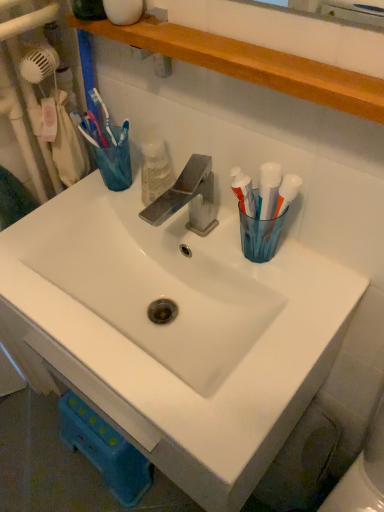
Question: Considering the positions of wooden shelf at upper center and white ceramic sink at center in the image, is wooden shelf at upper center wider or thinner than white ceramic sink at center?

Choices:
 (A) thin
 (B) wide

Answer: (A)

Question: Is wooden shelf at upper center bigger or smaller than white ceramic sink at center?

Choices:
 (A) big
 (B) small

Answer: (B)

Question: Estimate the real-world distances between objects in this image. Which object is farther from the translucent plastic toothbrush at upper left?

Choices:
 (A) wooden shelf at upper center
 (B) white ceramic sink at center

Answer: (B)

Question: Which is farther from the white ceramic sink at center?

Choices:
 (A) translucent plastic toothbrush at upper left
 (B) wooden shelf at upper center

Answer: (B)